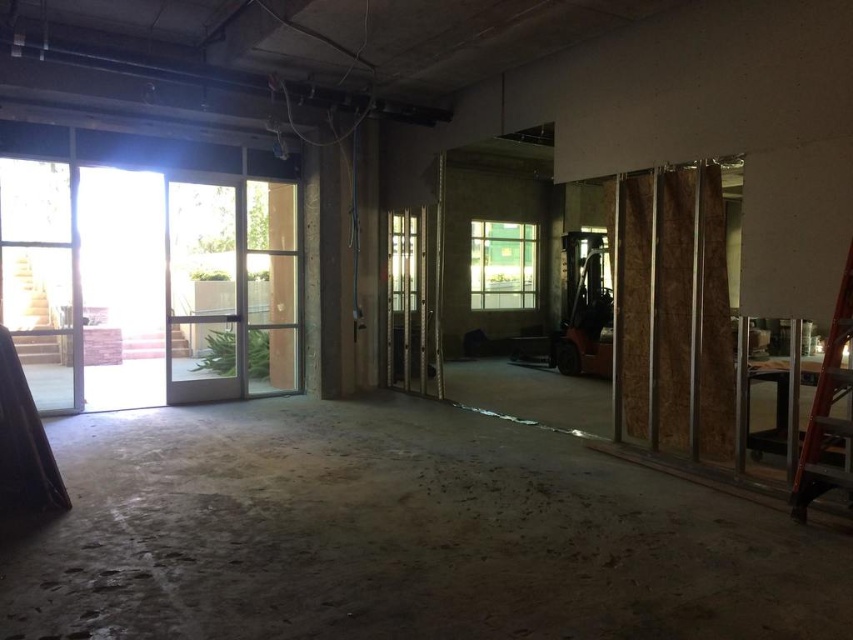
Is red wood ladder at right thinner than green glass window at center?

Correct, red wood ladder at right's width is less than green glass window at center's.

Which is above, red wood ladder at right or green glass window at center?

Positioned higher is green glass window at center.

Where is `red wood ladder at right`? Image resolution: width=853 pixels, height=640 pixels. red wood ladder at right is located at coordinates (828, 413).

Can you confirm if clear glass door at center is shorter than green glass window at center?

No.

Between clear glass door at center and green glass window at center, which one has more height?

Standing taller between the two is clear glass door at center.

Locate an element on the screen. This screenshot has width=853, height=640. clear glass door at center is located at coordinates (410, 304).

Measure the distance between clear glass door at center and camera.

The distance of clear glass door at center from camera is 7.19 meters.

Does clear glass door at center lie behind red wood ladder at right?

Yes, it is behind red wood ladder at right.

Where is `clear glass door at center`? The height and width of the screenshot is (640, 853). clear glass door at center is located at coordinates (410, 304).